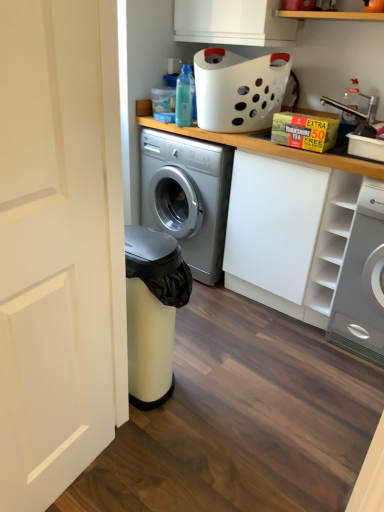
Where is `white glossy washing machine at right`? The height and width of the screenshot is (512, 384). white glossy washing machine at right is located at coordinates [x=362, y=281].

This screenshot has width=384, height=512. Identify the location of translucent plastic bottle at upper right. tap(352, 95).

I want to click on white matte cabinet at upper right, so click(264, 146).

What do you see at coordinates (330, 246) in the screenshot? I see `white matte cabinet at upper right` at bounding box center [330, 246].

Find the location of a particular element. This screenshot has height=512, width=384. white matte cabinet at upper right is located at coordinates (330, 246).

Identify the location of white glossy washing machine at right. (362, 281).

Is white glossy washing machine at right oriented towards translucent plastic bottle at upper right?

No.

This screenshot has width=384, height=512. I want to click on washing machine below the translucent plastic bottle at upper right (from a real-world perspective), so click(362, 281).

Does white glossy washing machine at right have a lesser width compared to translucent plastic bottle at upper right?

No, white glossy washing machine at right is not thinner than translucent plastic bottle at upper right.

From a real-world perspective, is white matte door at left physically located above or below white matte cabinet at upper right?

From a real-world perspective, white matte door at left is physically above white matte cabinet at upper right.

Considering the positions of point (93, 237) and point (382, 178), is point (93, 237) closer or farther from the camera than point (382, 178)?

Point (93, 237) appears to be closer to the viewer than point (382, 178).

Is white matte door at left facing towards white matte cabinet at upper right?

No, white matte door at left is not aimed at white matte cabinet at upper right.

Are white matte door at left and white matte cabinet at upper right far apart?

Indeed, white matte door at left is not near white matte cabinet at upper right.

In the scene shown: Does translucent plastic bottle at upper right have a lesser height compared to white matte door at left?

Yes, translucent plastic bottle at upper right is shorter than white matte door at left.

Are translucent plastic bottle at upper right and white matte door at left located far from each other?

Absolutely, translucent plastic bottle at upper right is distant from white matte door at left.

Consider the image. Which is correct: translucent plastic bottle at upper right is inside white matte door at left, or outside of it?

Answer: translucent plastic bottle at upper right exists outside the volume of white matte door at left.

Consider the image. From a real-world perspective, is translucent plastic bottle at upper right above or below white matte door at left?

Clearly, from a real-world perspective, translucent plastic bottle at upper right is above white matte door at left.

Is point (323, 236) closer or farther from the camera than point (190, 79)?

Point (323, 236).

Considering the sizes of white matte cabinet at upper right and translucent plastic bottle at upper center in the image, is white matte cabinet at upper right taller or shorter than translucent plastic bottle at upper center?

In the image, white matte cabinet at upper right appears to be taller than translucent plastic bottle at upper center.

How distant is white matte cabinet at upper right from translucent plastic bottle at upper center?

white matte cabinet at upper right and translucent plastic bottle at upper center are 94.74 centimeters apart.

Is white matte cabinet at upper right far away from translucent plastic bottle at upper center?

No, white matte cabinet at upper right is not far away from translucent plastic bottle at upper center.

Based on the photo, which object is closer to the camera taking this photo, translucent plastic bottle at upper center or white plastic sink at upper right?

white plastic sink at upper right.

Based on the photo, is translucent plastic bottle at upper center oriented towards white plastic sink at upper right?

No.

Is point (176, 109) positioned behind point (368, 117)?

Yes, point (176, 109) is behind point (368, 117).

From a real-world perspective, is translucent plastic bottle at upper center on top of white plastic sink at upper right?

Yes, from a real-world perspective, translucent plastic bottle at upper center is above white plastic sink at upper right.

Is white plastic sink at upper right spatially inside white matte cabinet at upper right, or outside of it?

white plastic sink at upper right exists outside the volume of white matte cabinet at upper right.

The height and width of the screenshot is (512, 384). In order to click on sink that appears behind the white matte cabinet at upper right in this screenshot , I will do `click(362, 130)`.

Is white plastic sink at upper right not close to white matte cabinet at upper right?

That's not correct — white plastic sink at upper right is a little close to white matte cabinet at upper right.

From the image's perspective, is white plastic sink at upper right above or below white matte cabinet at upper right?

white plastic sink at upper right is above white matte cabinet at upper right.

Consider the image. Considering the positions of objects white matte cabinet at upper right and translucent plastic bottle at upper right in the image provided, who is more to the left, white matte cabinet at upper right or translucent plastic bottle at upper right?

Positioned to the left is white matte cabinet at upper right.

From the picture: Could you tell me if white matte cabinet at upper right is facing translucent plastic bottle at upper right?

No, white matte cabinet at upper right is not oriented towards translucent plastic bottle at upper right.

Which object is wider, white matte cabinet at upper right or translucent plastic bottle at upper right?

Wider between the two is white matte cabinet at upper right.

In order to click on washing machine below the translucent plastic bottle at upper right (from a real-world perspective) in this screenshot , I will do `click(362, 281)`.

Where is `door below the white matte cabinet at upper right (from the image's perspective)`? door below the white matte cabinet at upper right (from the image's perspective) is located at coordinates [59, 246].

Based on their spatial positions, is white matte door at left or white plastic sink at upper right closer to translucent plastic bottle at upper center?

white plastic sink at upper right is positioned closer to the anchor translucent plastic bottle at upper center.

Considering their positions, is translucent plastic bottle at upper right positioned closer to white matte door at left than white matte cabinet at upper right?

Based on the image, white matte cabinet at upper right appears to be nearer to white matte door at left.

Looking at this image, estimate the real-world distances between objects in this image. Which object is closer to translucent plastic bottle at upper right, translucent plastic bottle at upper center or white glossy washing machine at right?

translucent plastic bottle at upper center is positioned closer to the anchor translucent plastic bottle at upper right.

Which object lies nearer to the anchor point translucent plastic bottle at upper right, white plastic sink at upper right or white matte cabinet at upper right?

The object closer to translucent plastic bottle at upper right is white plastic sink at upper right.

Considering their positions, is white matte cabinet at upper right positioned further to translucent plastic bottle at upper center than translucent plastic bottle at upper right?

white matte cabinet at upper right.

Estimate the real-world distances between objects in this image. Which object is further from white matte cabinet at upper right, translucent plastic bottle at upper right or white matte door at left?

Among the two, white matte door at left is located further to white matte cabinet at upper right.

In the scene shown: From the image, which object appears to be nearer to white matte cabinet at upper right, white plastic sink at upper right or translucent plastic bottle at upper right?

Based on the image, white plastic sink at upper right appears to be nearer to white matte cabinet at upper right.

Based on their spatial positions, is white matte cabinet at upper right or white glossy washing machine at right closer to white plastic sink at upper right?

white matte cabinet at upper right lies closer to white plastic sink at upper right than the other object.

The image size is (384, 512). In order to click on counter top that lies between white plastic sink at upper right and white glossy washing machine at right from top to bottom in this screenshot , I will do `click(264, 146)`.

Find the location of a particular element. This screenshot has width=384, height=512. shelf located between translucent plastic bottle at upper center and white glossy washing machine at right in the left-right direction is located at coordinates (330, 246).

You are a GUI agent. You are given a task and a screenshot of the screen. Output one action in this format:
    pyautogui.click(x=<x>, y=<y>)
    Task: Click on the counter top located between white matte door at left and translucent plastic bottle at upper right in the depth direction
    
    Given the screenshot: What is the action you would take?
    pyautogui.click(x=264, y=146)

You are a GUI agent. You are given a task and a screenshot of the screen. Output one action in this format:
    pyautogui.click(x=<x>, y=<y>)
    Task: Click on the cleaning product between translucent plastic bottle at upper center and white glossy washing machine at right
    This screenshot has width=384, height=512.
    Given the screenshot: What is the action you would take?
    pyautogui.click(x=352, y=95)